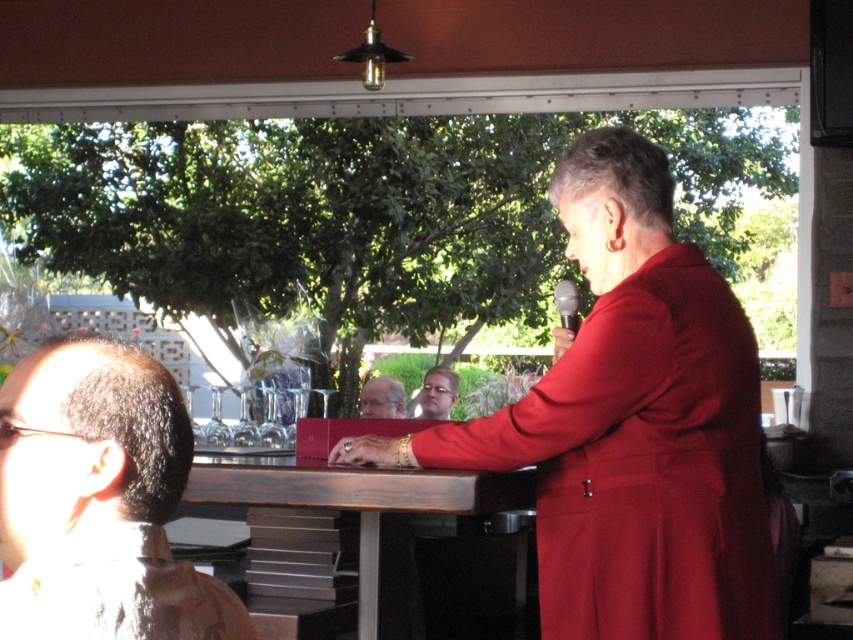
Question: Which point is farther from the camera taking this photo?

Choices:
 (A) (670, 211)
 (B) (125, 426)
 (C) (440, 417)
 (D) (129, 547)

Answer: (C)

Question: From the image, what is the correct spatial relationship of brown wood table at center in relation to matte red robe at center?

Choices:
 (A) right
 (B) left

Answer: (A)

Question: Which of these objects is positioned closest to the matte black glasses at center?

Choices:
 (A) matte plastic glasses at center
 (B) matte red robe at center
 (C) brown wood table at center
 (D) matte red coat at center

Answer: (A)

Question: Does matte red coat at center have a smaller size compared to brown hair at left?

Choices:
 (A) yes
 (B) no

Answer: (B)

Question: Can you confirm if matte black glasses at center is smaller than matte plastic glasses at center?

Choices:
 (A) yes
 (B) no

Answer: (B)

Question: Which point is farther from the camera taking this photo?

Choices:
 (A) (146, 630)
 (B) (231, 483)
 (C) (705, 509)
 (D) (439, 406)

Answer: (D)